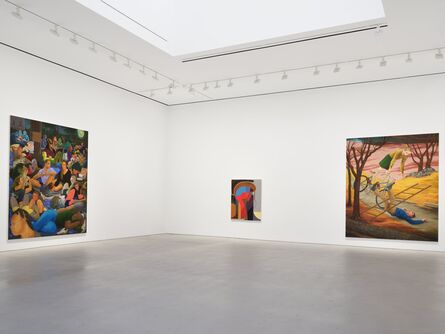
Where is `corner of room`? The height and width of the screenshot is (334, 445). corner of room is located at coordinates (165, 165).